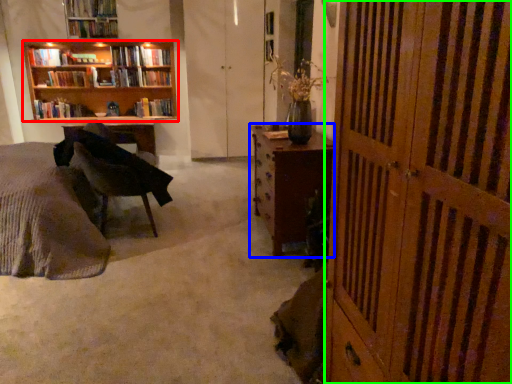
Question: Which object is positioned farthest from bookcase (highlighted by a red box)? Select from desk (highlighted by a blue box) and screen door (highlighted by a green box).

Choices:
 (A) desk
 (B) screen door

Answer: (B)